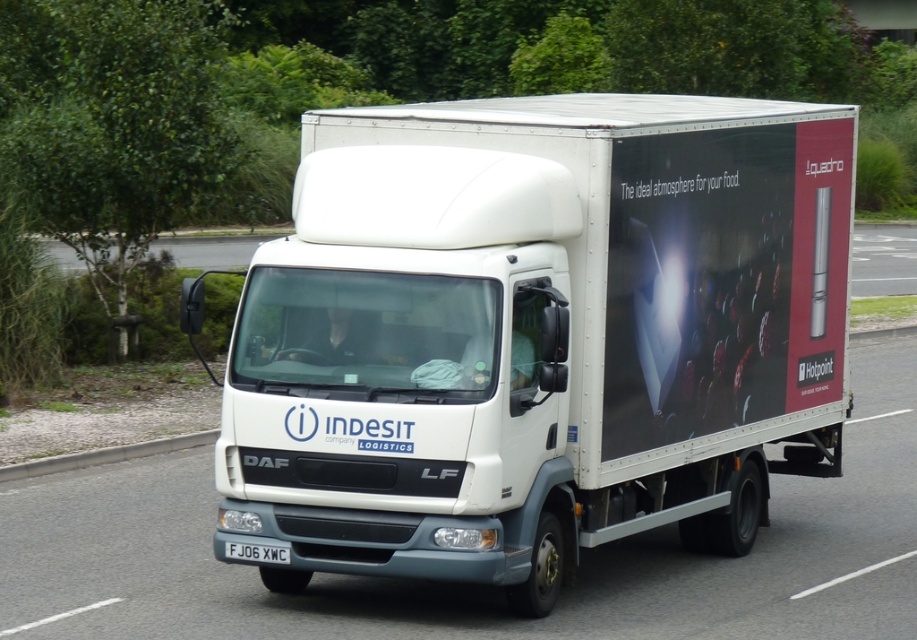
Question: Which object appears closest to the camera in this image?

Choices:
 (A) white plastic license plate at center
 (B) white matte trailer truck at center

Answer: (B)

Question: Does white matte trailer truck at center appear on the right side of white plastic license plate at center?

Choices:
 (A) yes
 (B) no

Answer: (A)

Question: Does white matte trailer truck at center appear on the right side of white plastic license plate at center?

Choices:
 (A) yes
 (B) no

Answer: (A)

Question: Observing the image, what is the correct spatial positioning of white matte trailer truck at center in reference to white plastic license plate at center?

Choices:
 (A) left
 (B) right

Answer: (B)

Question: Which point appears farthest from the camera in this image?

Choices:
 (A) (768, 273)
 (B) (256, 556)

Answer: (A)

Question: Which point is farther to the camera?

Choices:
 (A) (442, 346)
 (B) (249, 552)

Answer: (B)